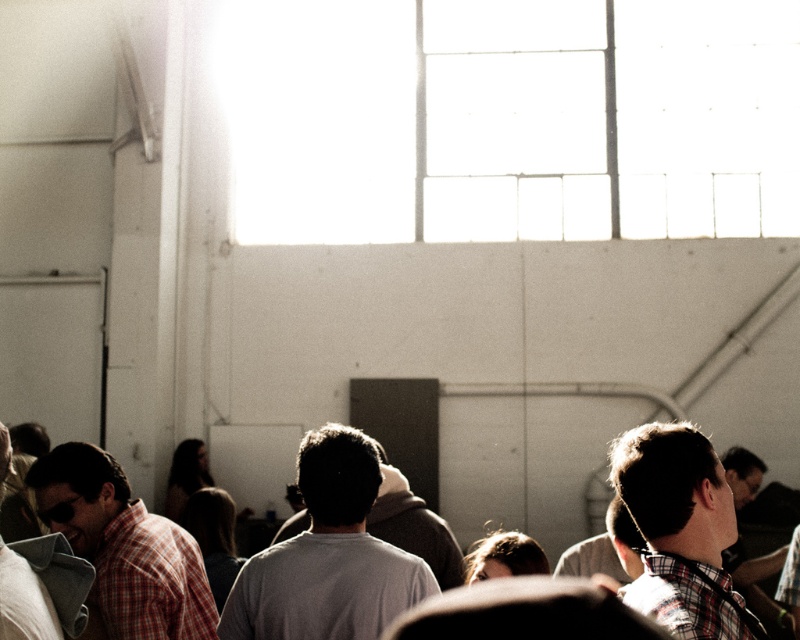
Looking at this image, you are a photographer trying to capture a clear shot of the two gray shirts at the center of the crowd. Since both shirts are the same color, how can you distinguish which one is the gray matte shirt at center and which is the gray cotton shirt at center?

The gray matte shirt at center is shorter than the gray cotton shirt at center, so the shorter one is the matte shirt and the taller one is the cotton shirt.

You are standing in the industrial room and want to take a photo of both the point at (196, 573) and the point at (716, 513). Which point should you focus on first to ensure both are in focus?

You should focus on the point at (196, 573) first because it is closer to the camera than the point at (716, 513). This way, adjusting the focus from near to far will help both points come into focus.

You are standing in the industrial room and want to greet the person wearing the gray cotton shirt at center and the person wearing the plaid shirt at left. Which person should you approach first to reach them more quickly?

You should approach the gray cotton shirt at center first because it is closer to you than the plaid shirt at left, so you can reach them more quickly.